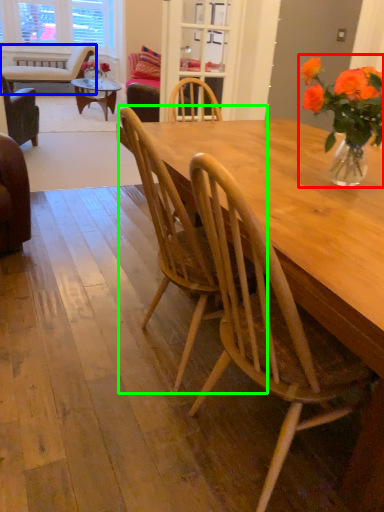
Question: Which object is positioned closest to floral arrangement (highlighted by a red box)? Select from chair (highlighted by a blue box) and chair (highlighted by a green box).

Choices:
 (A) chair
 (B) chair

Answer: (B)